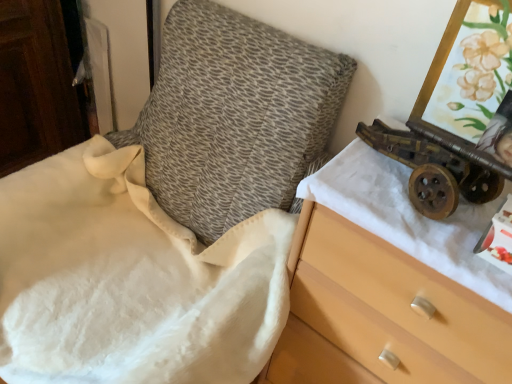
Question: From the image's perspective, relative to rusty metal cannon at right, is wooden drawer at right above or below?

Choices:
 (A) below
 (B) above

Answer: (A)

Question: From a real-world perspective, relative to rusty metal cannon at right, is wooden drawer at right vertically above or below?

Choices:
 (A) below
 (B) above

Answer: (A)

Question: Which of these objects is positioned closest to the wooden drawer at right?

Choices:
 (A) wooden chest of drawers at right
 (B) rusty metal cannon at right

Answer: (A)

Question: Based on their relative distances, which object is farther from the wooden chest of drawers at right?

Choices:
 (A) wooden drawer at right
 (B) rusty metal cannon at right

Answer: (A)